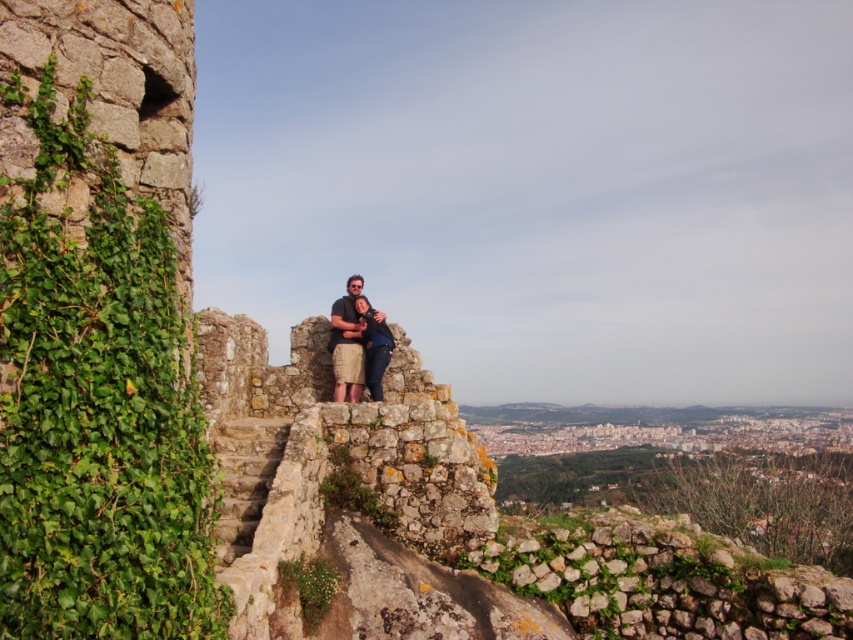
Question: Which point is closer to the camera taking this photo?

Choices:
 (A) (181, 602)
 (B) (366, 328)

Answer: (A)

Question: Does matte khaki shorts at center appear on the left side of denim shorts at center?

Choices:
 (A) no
 (B) yes

Answer: (B)

Question: Considering the relative positions of green leafy ivy at left and denim shorts at center in the image provided, where is green leafy ivy at left located with respect to denim shorts at center?

Choices:
 (A) above
 (B) below

Answer: (B)

Question: Which point is closer to the camera?

Choices:
 (A) denim shorts at center
 (B) matte khaki shorts at center
 (C) green leafy ivy at left

Answer: (C)

Question: Does green leafy ivy at left appear under denim shorts at center?

Choices:
 (A) yes
 (B) no

Answer: (A)

Question: Among these objects, which one is farthest from the camera?

Choices:
 (A) green leafy ivy at left
 (B) matte khaki shorts at center

Answer: (B)